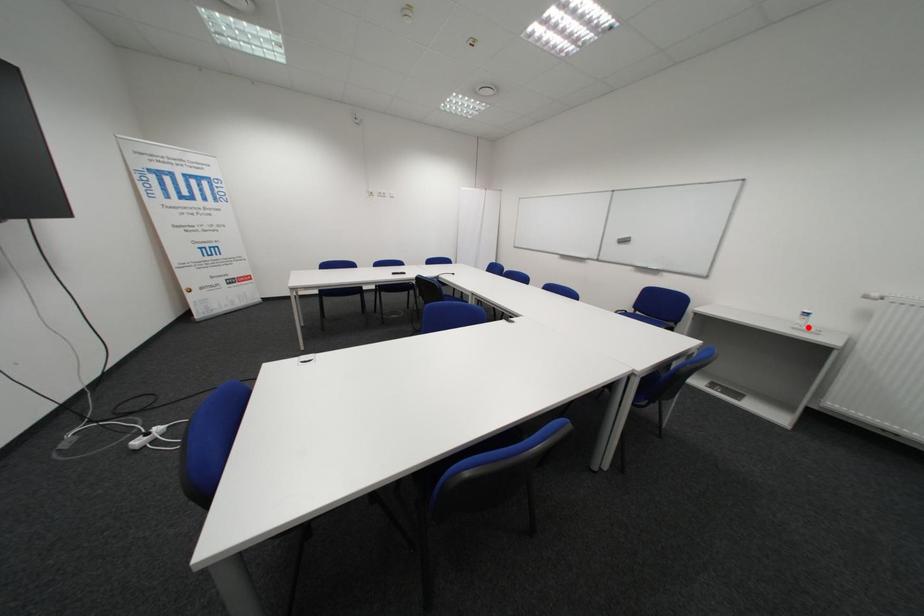
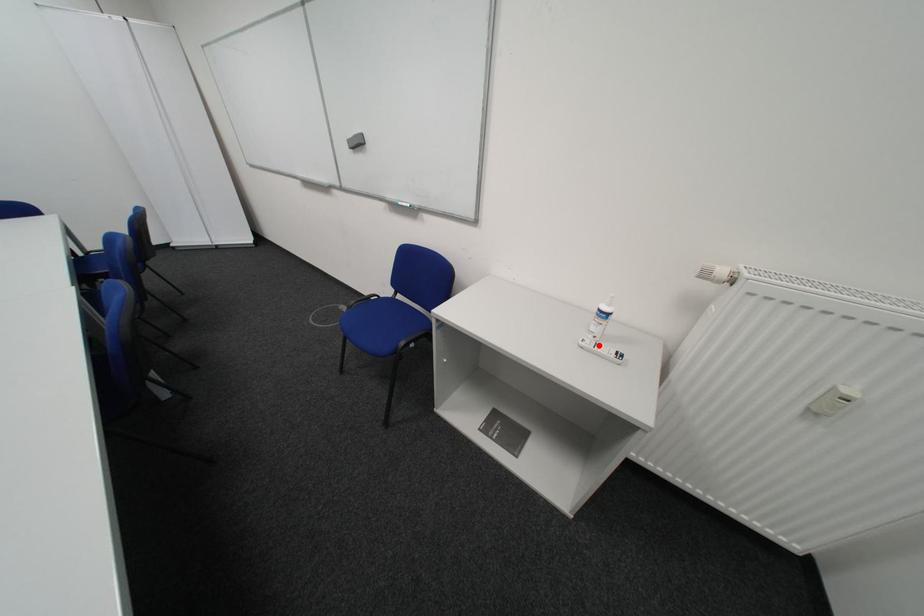
I am providing you with two images of the same scene from different viewpoints. A red point is marked on the first image and another point is marked on the second image. Are the points marked in image1 and image2 representing the same 3D position?

Yes